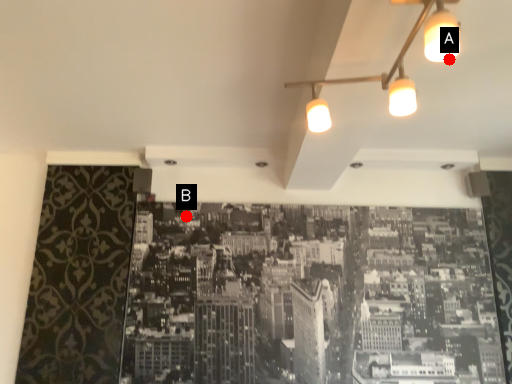
Question: Two points are circled on the image, labeled by A and B beside each circle. Which point is closer to the camera taking this photo?

Choices:
 (A) A is closer
 (B) B is closer

Answer: (A)